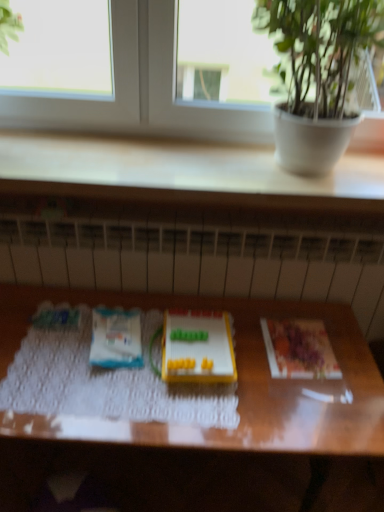
Question: Is printed paper at right, which appears as the first paperback book when viewed from the right, wider or thinner than white matte paper at center, which is the 2th paperback book from right to left?

Choices:
 (A) thin
 (B) wide

Answer: (A)

Question: From a real-world perspective, is printed paper at right, which appears as the first paperback book when viewed from the right, positioned above or below white matte paper at center, the 1th paperback book when ordered from left to right?

Choices:
 (A) above
 (B) below

Answer: (B)

Question: Estimate the real-world distances between objects in this image. Which object is farther from the printed paper at right, the 2th paperback book viewed from the left?

Choices:
 (A) white matte paper at center, which is the 2th paperback book from right to left
 (B) white textured radiator at center
 (C) wooden table at center
 (D) yellow plastic toy at center
 (E) transparent glass window at upper center

Answer: (E)

Question: Considering the real-world distances, which object is farthest from the yellow plastic toy at center?

Choices:
 (A) printed paper at right, the 2th paperback book viewed from the left
 (B) white matte paper at center, the 1th paperback book when ordered from left to right
 (C) white textured radiator at center
 (D) wooden table at center
 (E) transparent glass window at upper center

Answer: (E)